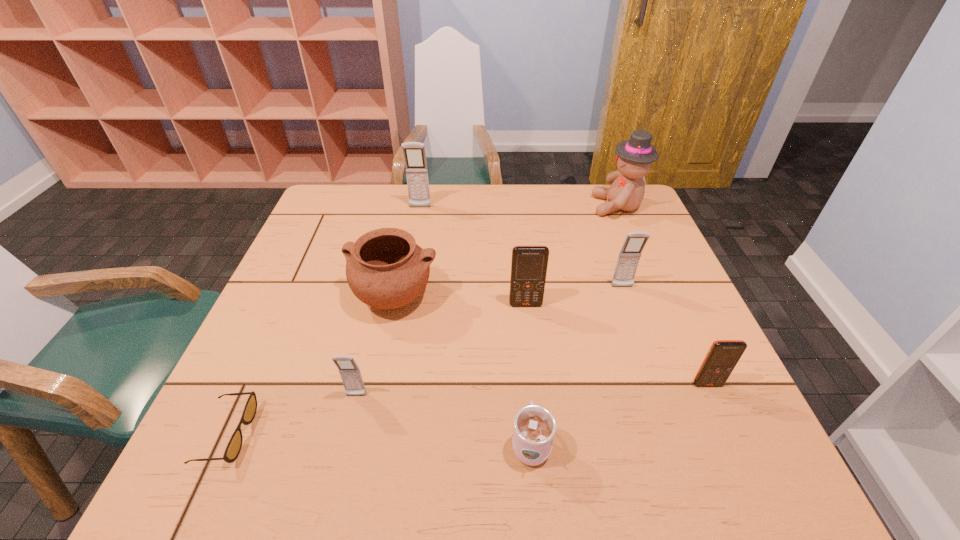
This screenshot has height=540, width=960. I want to click on rag_doll, so click(634, 157).

Find the location of `the biggest gray cellular telephone`. the biggest gray cellular telephone is located at coordinates (414, 154).

Find the location of a particular element. The width and height of the screenshot is (960, 540). the farthest gray cellular telephone is located at coordinates (414, 154).

Locate an element on the screen. The height and width of the screenshot is (540, 960). the rightmost gray cellular telephone is located at coordinates (628, 259).

You are a GUI agent. You are given a task and a screenshot of the screen. Output one action in this format:
    pyautogui.click(x=<x>, y=<y>)
    Task: Click on the second smallest gray cellular telephone
    This screenshot has width=960, height=540.
    Given the screenshot: What is the action you would take?
    pyautogui.click(x=628, y=259)

What are the coordinates of `the bigger orange cellular telephone` in the screenshot? It's located at (529, 264).

Locate an element on the screen. This screenshot has height=540, width=960. the third cellular telephone from left to right is located at coordinates (529, 264).

Where is `pottery`? This screenshot has width=960, height=540. pottery is located at coordinates (385, 268).

At what (x,y) coordinates should I click in order to perform the action: click on the right orange cellular telephone. Please return your answer as a coordinate pair (x, y). This screenshot has width=960, height=540. Looking at the image, I should click on (723, 355).

Locate an element on the screen. the smaller orange cellular telephone is located at coordinates pyautogui.click(x=723, y=355).